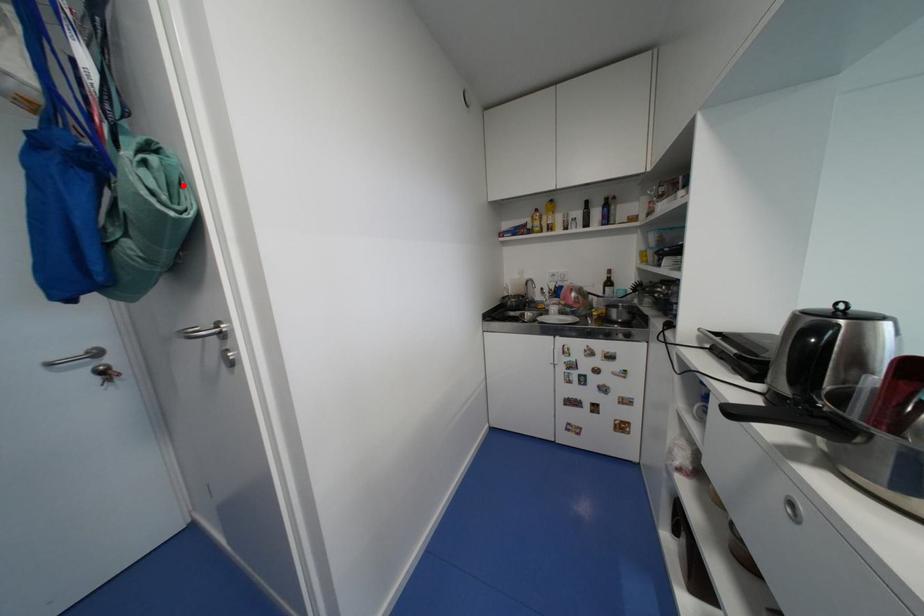
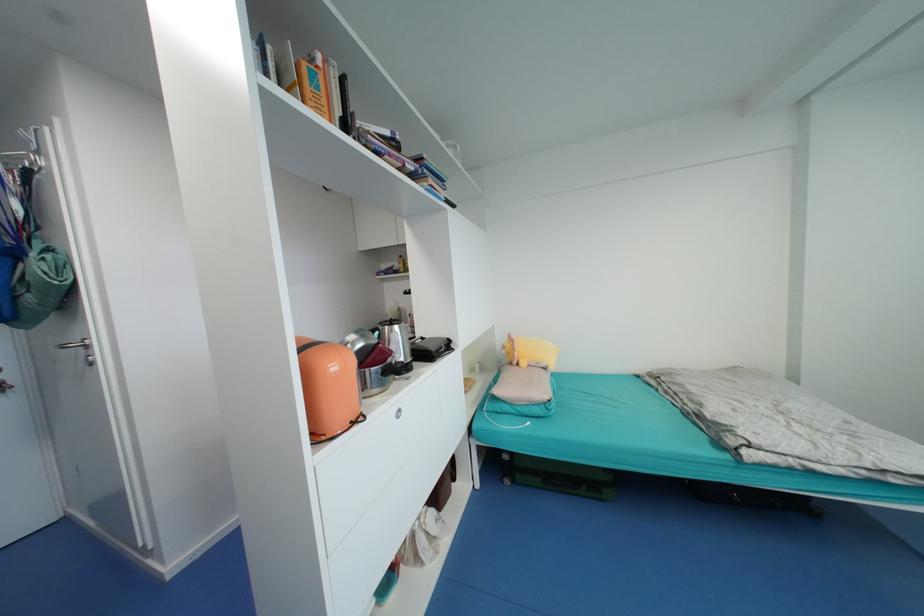
Where in the second image is the point corresponding to the highlighted location from the first image?

(68, 267)